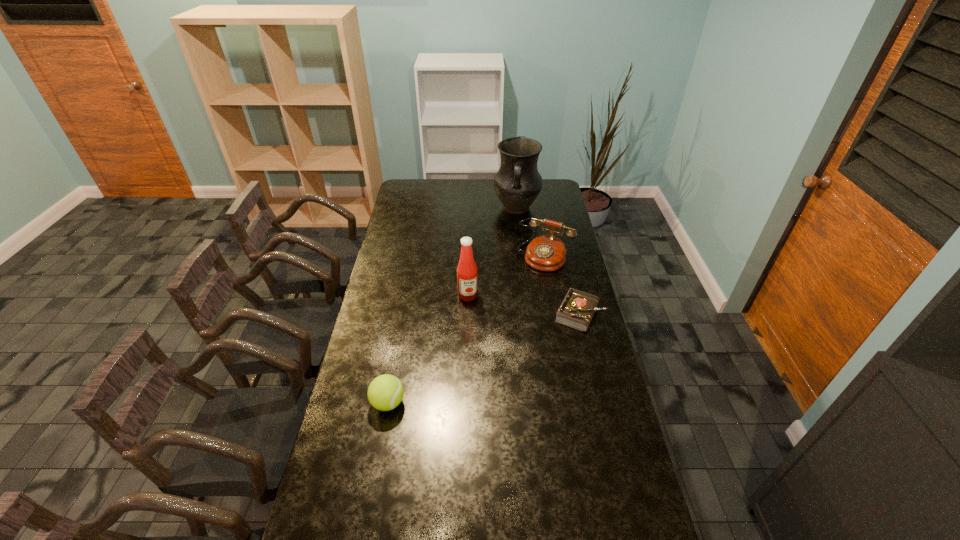
This screenshot has height=540, width=960. I want to click on free space located 0.070m on the left of the diary, so click(537, 314).

The width and height of the screenshot is (960, 540). What are the coordinates of `free space located on the front-facing side of the condiment` in the screenshot? It's located at (484, 365).

Locate an element on the screen. This screenshot has height=540, width=960. free space located 0.290m on the front-facing side of the condiment is located at coordinates (482, 356).

At what (x,y) coordinates should I click in order to perform the action: click on free space located on the front-facing side of the condiment. Please return your answer as a coordinate pair (x, y). Looking at the image, I should click on (483, 363).

I want to click on vacant space located on the handle side of the pitcher, so click(514, 233).

Identify the location of free space located on the handle side of the pitcher. The height and width of the screenshot is (540, 960). (513, 249).

Identify the location of vacant space located on the handle side of the pitcher. (514, 238).

What are the coordinates of `vacant space situated on the dial of the third shortest object` in the screenshot? It's located at (512, 308).

Locate an element on the screen. The height and width of the screenshot is (540, 960). vacant space located 0.340m on the dial of the third shortest object is located at coordinates (505, 319).

Locate an element on the screen. This screenshot has width=960, height=540. vacant region located 0.160m on the dial of the third shortest object is located at coordinates (522, 292).